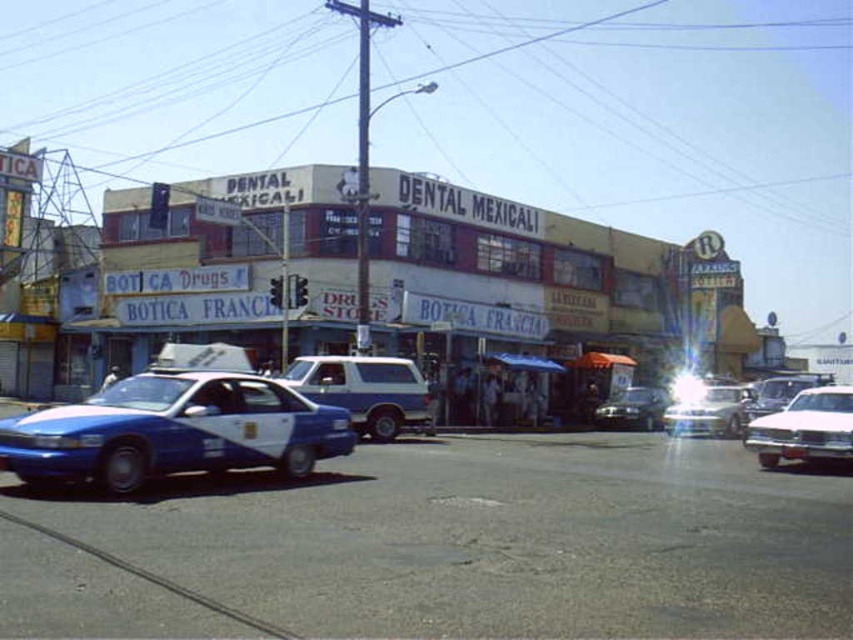
Between white matte building at center and pink glossy sedan at right, which one has less height?

With less height is pink glossy sedan at right.

Can you confirm if white matte building at center is bigger than pink glossy sedan at right?

Yes.

Does point (244, 317) lie behind point (845, 396)?

Yes, point (244, 317) is behind point (845, 396).

I want to click on white matte building at center, so click(x=396, y=291).

Is point (173, 387) positioned behind point (807, 404)?

No, it is in front of (807, 404).

Is point (178, 403) positioned in front of point (776, 432)?

Yes, point (178, 403) is closer to viewer.

Identify the location of blue glossy sedan at lower left. This screenshot has width=853, height=640. (175, 426).

Is white matte building at center shorter than blue metallic taxi at center?

No.

Between white matte building at center and blue metallic taxi at center, which one is positioned higher?

white matte building at center

Between point (489, 280) and point (413, 397), which one is positioned in front?

Point (413, 397)

You are a GUI agent. You are given a task and a screenshot of the screen. Output one action in this format:
    pyautogui.click(x=<x>, y=<y>)
    Task: Click on the white matte building at center
    This screenshot has width=853, height=640.
    Given the screenshot: What is the action you would take?
    (x=396, y=291)